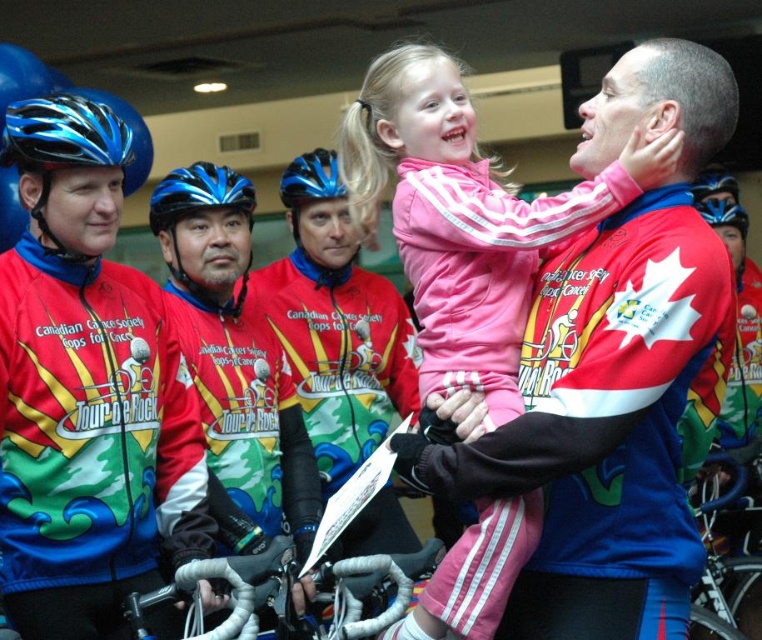
Is blue matte bicycle helmet at upper left above blue glossy bicycle helmet at center?

Actually, blue matte bicycle helmet at upper left is below blue glossy bicycle helmet at center.

Between blue matte bicycle helmet at upper left and blue glossy bicycle helmet at center, which one is positioned higher?

blue glossy bicycle helmet at center is above.

Is point (63, 138) farther from viewer compared to point (312, 198)?

No, it is not.

I want to click on blue matte bicycle helmet at upper left, so click(66, 132).

Looking at this image, can you confirm if pink fleece jacket at center is positioned below red and white jersey at left?

No, pink fleece jacket at center is not below red and white jersey at left.

Is pink fleece jacket at center shorter than red and white jersey at left?

Yes, pink fleece jacket at center is shorter than red and white jersey at left.

Is point (412, 625) farther from viewer compared to point (280, 468)?

No, (412, 625) is in front of (280, 468).

The width and height of the screenshot is (762, 640). I want to click on pink fleece jacket at center, so click(x=466, y=218).

The height and width of the screenshot is (640, 762). What do you see at coordinates (285, 596) in the screenshot? I see `white textured bicycle handlebars at center` at bounding box center [285, 596].

Can you confirm if white textured bicycle handlebars at center is positioned below blue matte bicycle helmet at center?

Yes, white textured bicycle handlebars at center is below blue matte bicycle helmet at center.

Identify the location of white textured bicycle handlebars at center. (285, 596).